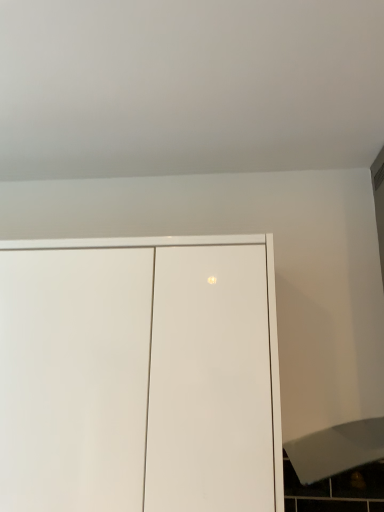
Find the location of a particular element. The image size is (384, 512). white glossy cupboard at center is located at coordinates (140, 375).

From the picture: What is the approximate width of white glossy cupboard at center?

It is 13.21 inches.

The width and height of the screenshot is (384, 512). What do you see at coordinates (140, 375) in the screenshot? I see `white glossy cupboard at center` at bounding box center [140, 375].

Where is `white glossy cupboard at center`? This screenshot has height=512, width=384. white glossy cupboard at center is located at coordinates (140, 375).